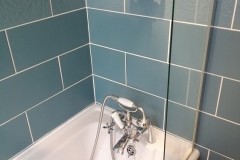
Identify the location of wall corner. (88, 24), (88, 93).